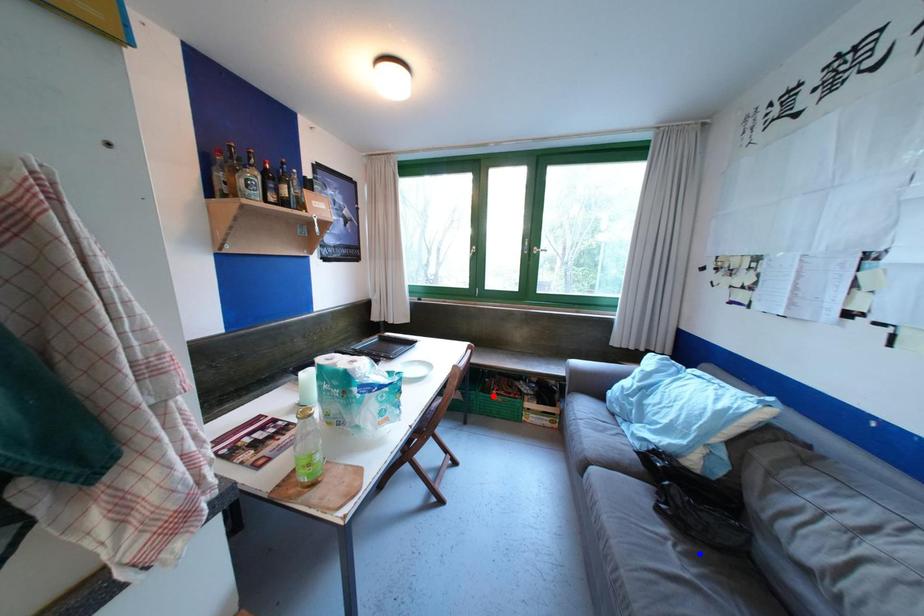
Question: In the image, two points are highlighted. Which point is nearer to the camera? Reply with the corresponding letter.

Choices:
 (A) blue point
 (B) red point

Answer: (A)